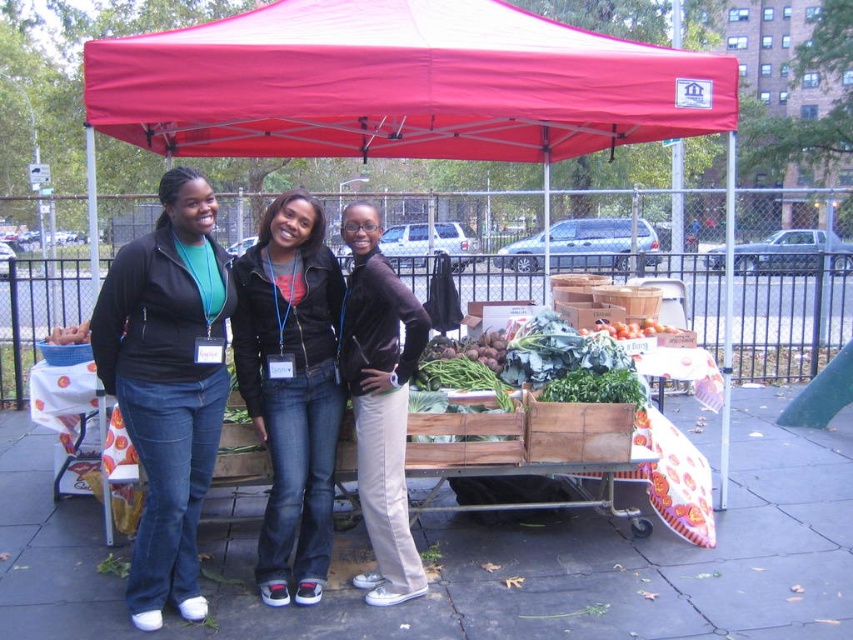
What are the coordinates of the matte red canopy at upper center in the image?

The coordinates of the matte red canopy at upper center are at point (399, 84).

You are standing at the entrance of the market and see the point marked as point (399, 84). What object does this point correspond to?

The point (399, 84) corresponds to the matte red canopy at upper center.

You are a photographer trying to capture the matte black jacket at center and denim jeans at center in a single shot. Since the jacket is covering part of the jeans, will you need to adjust your angle to fully show both items?

The matte black jacket at center is positioned over denim jeans at center, so adjusting your angle might help reveal more of the jeans underneath. However, since the jacket is covering part of the jeans, it may not be possible to fully show both items without moving the jacket or the jeans.